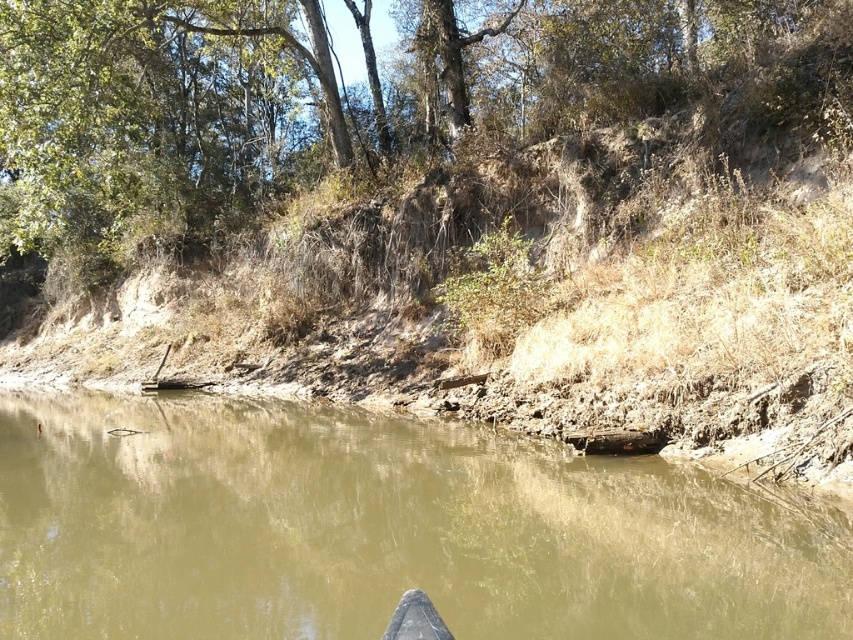
Question: Where is brown muddy water at center located in relation to green leafy tree at upper center in the image?

Choices:
 (A) above
 (B) below

Answer: (B)

Question: Among these points, which one is nearest to the camera?

Choices:
 (A) (109, 577)
 (B) (489, 64)

Answer: (A)

Question: Does brown muddy water at center appear on the left side of green leafy tree at upper center?

Choices:
 (A) no
 (B) yes

Answer: (A)

Question: Among these objects, which one is farthest from the camera?

Choices:
 (A) green leafy tree at upper center
 (B) brown muddy water at center

Answer: (A)

Question: Does brown muddy water at center have a smaller size compared to green leafy tree at upper center?

Choices:
 (A) yes
 (B) no

Answer: (A)